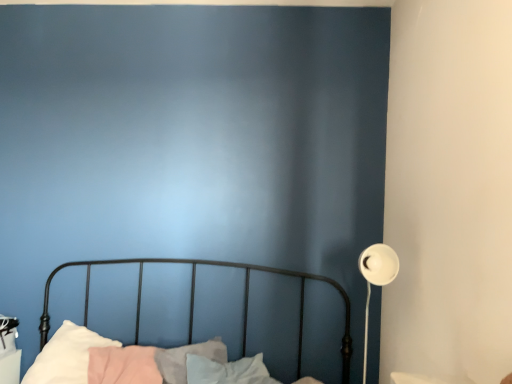
Describe the element at coordinates (194, 300) in the screenshot. I see `metallic black bed at lower left` at that location.

What are the coordinates of `metallic black bed at lower left` in the screenshot? It's located at pos(194,300).

In order to face metallic black bed at lower left, should I rotate leftwards or rightwards?

Rotate your view left by about 14.857°.

Describe the element at coordinates (376, 279) in the screenshot. This screenshot has height=384, width=512. I see `white matte floor lamp at right` at that location.

What is the approximate height of white matte floor lamp at right?

It is 27.20 inches.

Identify the location of white matte floor lamp at right. This screenshot has width=512, height=384. (376, 279).

This screenshot has height=384, width=512. I want to click on metallic black bed at lower left, so click(x=194, y=300).

Which is more to the right, white matte floor lamp at right or metallic black bed at lower left?

Positioned to the right is white matte floor lamp at right.

Which object is closer to the camera taking this photo, white matte floor lamp at right or metallic black bed at lower left?

metallic black bed at lower left is closer to the camera.

Is point (365, 353) positioned after point (301, 280)?

No, (365, 353) is closer to viewer.

From the image's perspective, between white matte floor lamp at right and metallic black bed at lower left, which one is located above?

white matte floor lamp at right is shown above in the image.

From a real-world perspective, who is located lower, white matte floor lamp at right or metallic black bed at lower left?

metallic black bed at lower left, from a real-world perspective.

Is white matte floor lamp at right thinner than metallic black bed at lower left?

Yes.

Considering the relative sizes of white matte floor lamp at right and metallic black bed at lower left in the image provided, is white matte floor lamp at right shorter than metallic black bed at lower left?

Yes, white matte floor lamp at right is shorter than metallic black bed at lower left.

Considering the sizes of objects white matte floor lamp at right and metallic black bed at lower left in the image provided, who is smaller, white matte floor lamp at right or metallic black bed at lower left?

With smaller size is white matte floor lamp at right.

Is white matte floor lamp at right spatially inside metallic black bed at lower left, or outside of it?

white matte floor lamp at right is contained in metallic black bed at lower left.

Is white matte floor lamp at right beside metallic black bed at lower left?

No, white matte floor lamp at right is not in contact with metallic black bed at lower left.

Is white matte floor lamp at right looking in the opposite direction of metallic black bed at lower left?

Yes, metallic black bed at lower left is at the back of white matte floor lamp at right.

Can you tell me how much white matte floor lamp at right and metallic black bed at lower left differ in facing direction?

white matte floor lamp at right and metallic black bed at lower left are facing 85.3 degrees away from each other.

Looking at this image, how distant is white matte floor lamp at right from metallic black bed at lower left?

white matte floor lamp at right is 33.14 inches away from metallic black bed at lower left.

Find the location of a particular element. bed on the left of white matte floor lamp at right is located at coordinates (194, 300).

Considering the relative positions of metallic black bed at lower left and white matte floor lamp at right in the image provided, is metallic black bed at lower left to the left of white matte floor lamp at right from the viewer's perspective?

Indeed, metallic black bed at lower left is positioned on the left side of white matte floor lamp at right.

Between metallic black bed at lower left and white matte floor lamp at right, which one is positioned behind?

white matte floor lamp at right.

Considering the points (52, 275) and (362, 260), which point is in front, point (52, 275) or point (362, 260)?

The point (362, 260) is in front.

From the image's perspective, who appears lower, metallic black bed at lower left or white matte floor lamp at right?

From the image's view, metallic black bed at lower left is below.

From a real-world perspective, who is located lower, metallic black bed at lower left or white matte floor lamp at right?

In real-world perspective, metallic black bed at lower left is lower.

Which of these two, metallic black bed at lower left or white matte floor lamp at right, is thinner?

white matte floor lamp at right.

Is metallic black bed at lower left taller or shorter than white matte floor lamp at right?

In the image, metallic black bed at lower left appears to be taller than white matte floor lamp at right.

Which of these two, metallic black bed at lower left or white matte floor lamp at right, is bigger?

metallic black bed at lower left is bigger.

Is white matte floor lamp at right surrounded by metallic black bed at lower left?

Yes, white matte floor lamp at right is a part of metallic black bed at lower left.

From the picture: Is metallic black bed at lower left far from white matte floor lamp at right?

Actually, metallic black bed at lower left and white matte floor lamp at right are a little close together.

Is metallic black bed at lower left oriented towards white matte floor lamp at right?

No, metallic black bed at lower left is not oriented towards white matte floor lamp at right.

Locate an element on the screen. This screenshot has height=384, width=512. bed below the white matte floor lamp at right (from the image's perspective) is located at coordinates (194, 300).

I want to click on bed on the left side of white matte floor lamp at right, so click(194, 300).

Find the location of `bed below the white matte floor lamp at right (from the image's perspective)`. bed below the white matte floor lamp at right (from the image's perspective) is located at coordinates (194, 300).